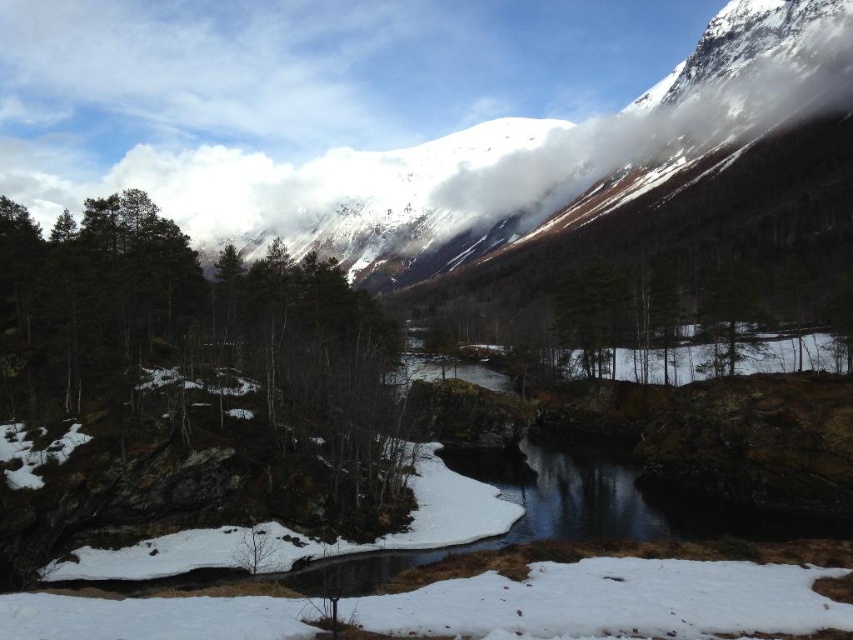
Question: Observing the image, what is the correct spatial positioning of green matte tree at center in reference to white fluffy cloud at upper center?

Choices:
 (A) left
 (B) right

Answer: (A)

Question: Which point appears farthest from the camera in this image?

Choices:
 (A) (198, 353)
 (B) (796, 83)

Answer: (B)

Question: Can you confirm if green matte tree at center is positioned to the right of white fluffy cloud at upper center?

Choices:
 (A) yes
 (B) no

Answer: (B)

Question: Which of the following is the closest to the observer?

Choices:
 (A) [193, 280]
 (B) [753, 108]

Answer: (A)

Question: Does green matte tree at center appear over white fluffy cloud at upper center?

Choices:
 (A) no
 (B) yes

Answer: (A)